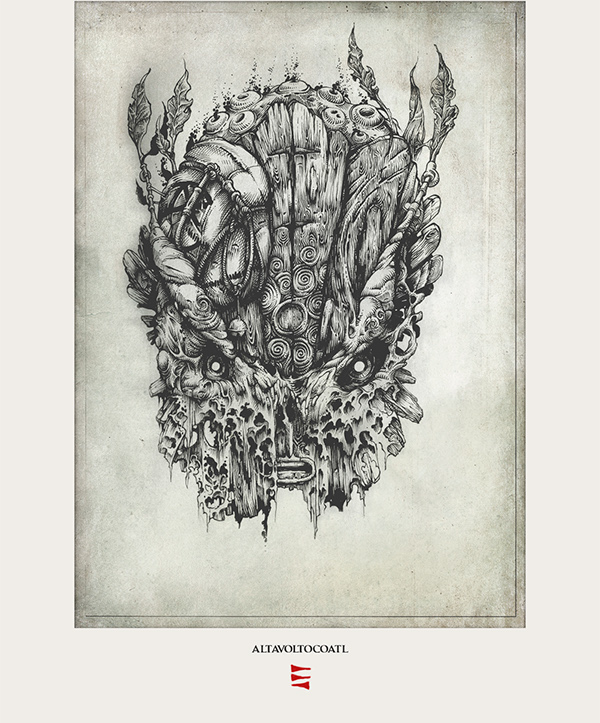
Find the location of a particular element. bottom left white corner photo mat is located at coordinates tap(2, 716).